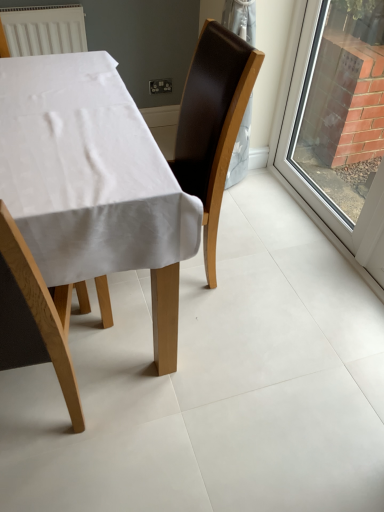
The width and height of the screenshot is (384, 512). What are the coordinates of `vacant area situated to the left side of clear glass window at right` in the screenshot? It's located at (267, 209).